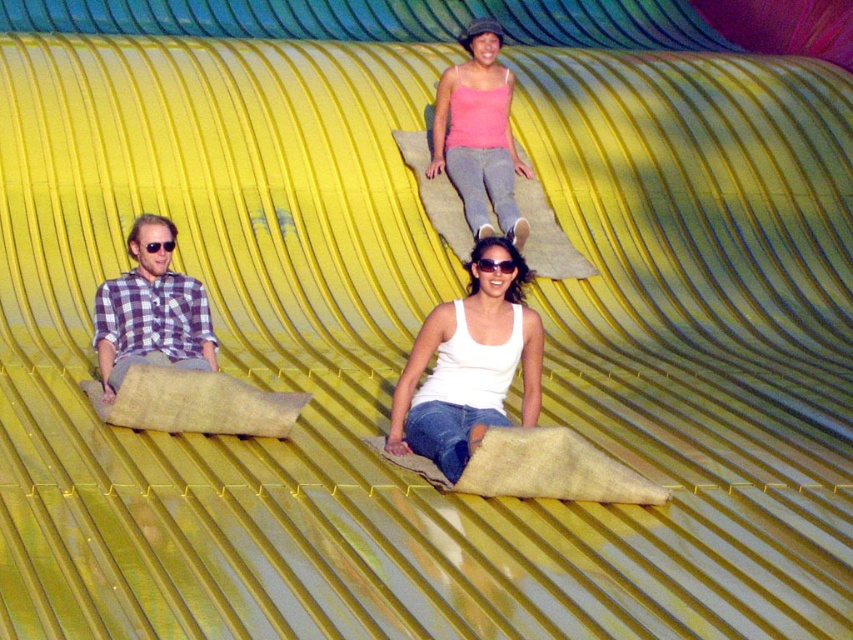
Question: Among these objects, which one is farthest from the camera?

Choices:
 (A) plaid shirt at left
 (B) white matte tank top at center

Answer: (A)

Question: Estimate the real-world distances between objects in this image. Which object is closer to the white matte tank top at center?

Choices:
 (A) pink cotton tank top at upper center
 (B) plaid shirt at left

Answer: (B)

Question: Can you confirm if white matte tank top at center is positioned to the right of pink cotton tank top at upper center?

Choices:
 (A) no
 (B) yes

Answer: (A)

Question: Can you confirm if white matte tank top at center is positioned below pink cotton tank top at upper center?

Choices:
 (A) yes
 (B) no

Answer: (A)

Question: Estimate the real-world distances between objects in this image. Which object is farther from the plaid shirt at left?

Choices:
 (A) white matte tank top at center
 (B) pink cotton tank top at upper center

Answer: (B)

Question: Does white matte tank top at center have a larger size compared to pink cotton tank top at upper center?

Choices:
 (A) no
 (B) yes

Answer: (A)